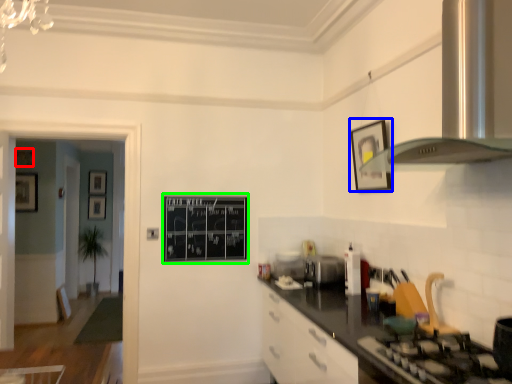
Question: Estimate the real-world distances between objects in this image. Which object is closer to picture frame (highlighted by a red box), picture frame (highlighted by a blue box) or bulletin board (highlighted by a green box)?

Choices:
 (A) picture frame
 (B) bulletin board

Answer: (B)